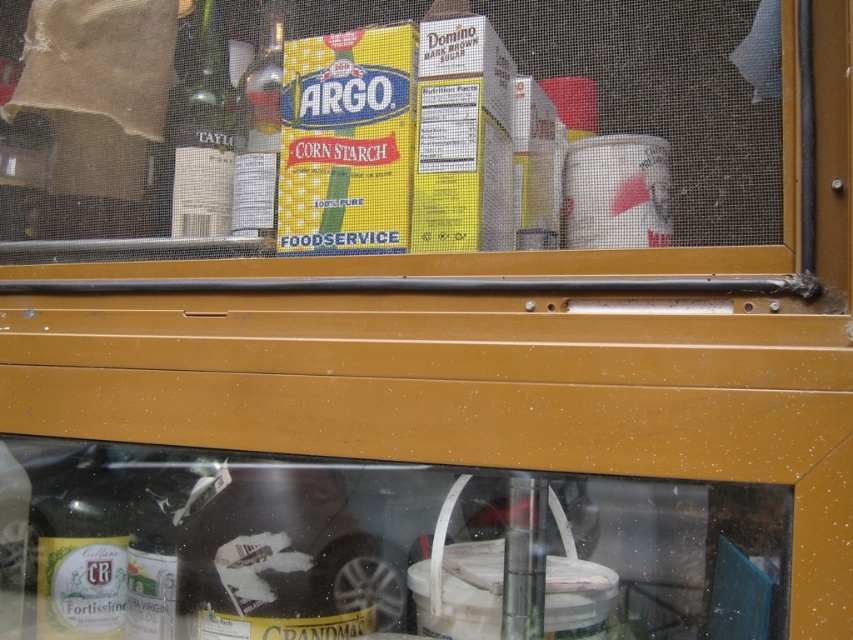
Question: Can you confirm if green glass bottle at left is wider than metallic silver bottle at upper left?

Choices:
 (A) no
 (B) yes

Answer: (B)

Question: Among these points, which one is farthest from the camera?

Choices:
 (A) (180, 262)
 (B) (195, 10)
 (C) (270, 211)

Answer: (B)

Question: Which point is farther to the camera?

Choices:
 (A) (250, 218)
 (B) (793, 4)

Answer: (A)

Question: Where is yellow cardboard box at center located in relation to green glass bottle at left in the image?

Choices:
 (A) left
 (B) right

Answer: (B)

Question: Is yellow cardboard box at center bigger than metallic silver bottle at upper left?

Choices:
 (A) yes
 (B) no

Answer: (A)

Question: Which point is farther to the camera?

Choices:
 (A) (566, 253)
 (B) (209, 35)

Answer: (B)